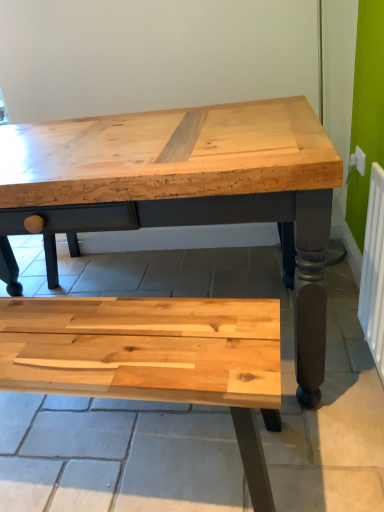
Describe the element at coordinates (153, 358) in the screenshot. I see `natural wood bench at center` at that location.

At what (x,y) coordinates should I click in order to perform the action: click on natural wood bench at center. Please return your answer as a coordinate pair (x, y). The image size is (384, 512). Looking at the image, I should click on (153, 358).

Where is `natural wood bench at center`? This screenshot has height=512, width=384. natural wood bench at center is located at coordinates (153, 358).